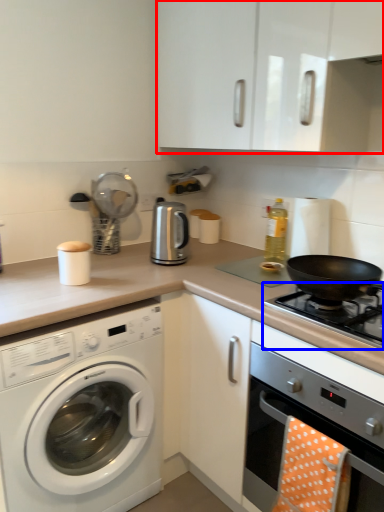
Question: Among these objects, which one is nearest to the camera, cabinetry (highlighted by a red box) or gas stove (highlighted by a blue box)?

Choices:
 (A) cabinetry
 (B) gas stove

Answer: (A)